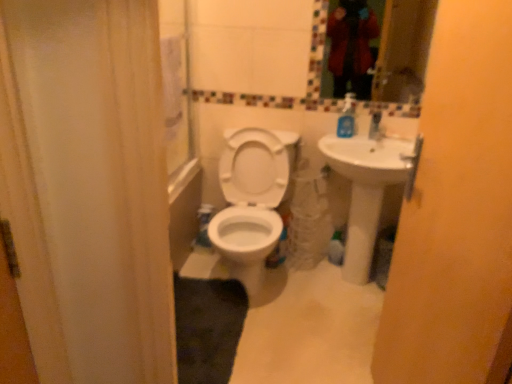
Find the location of `vacant area that is in front of white glossy toilet at center`. vacant area that is in front of white glossy toilet at center is located at coordinates (293, 344).